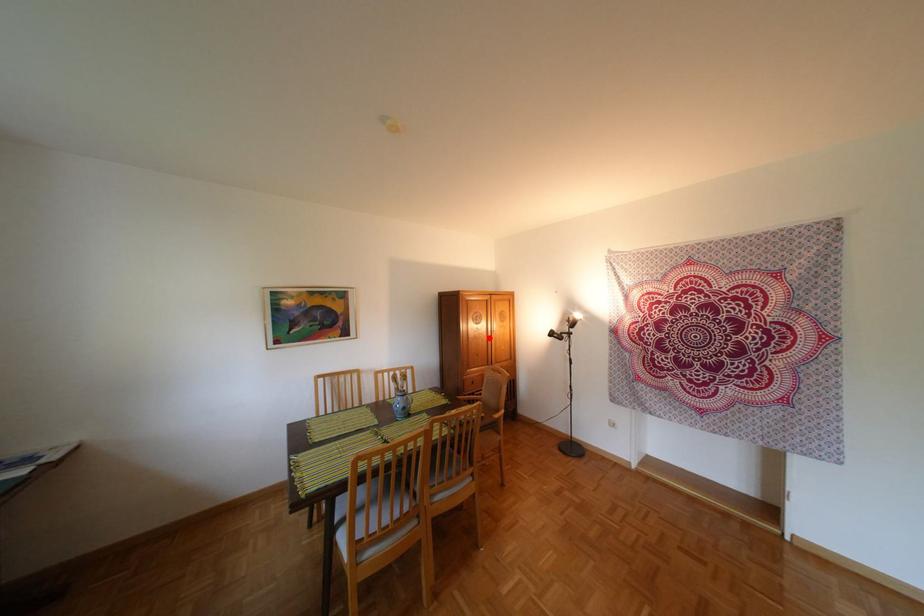
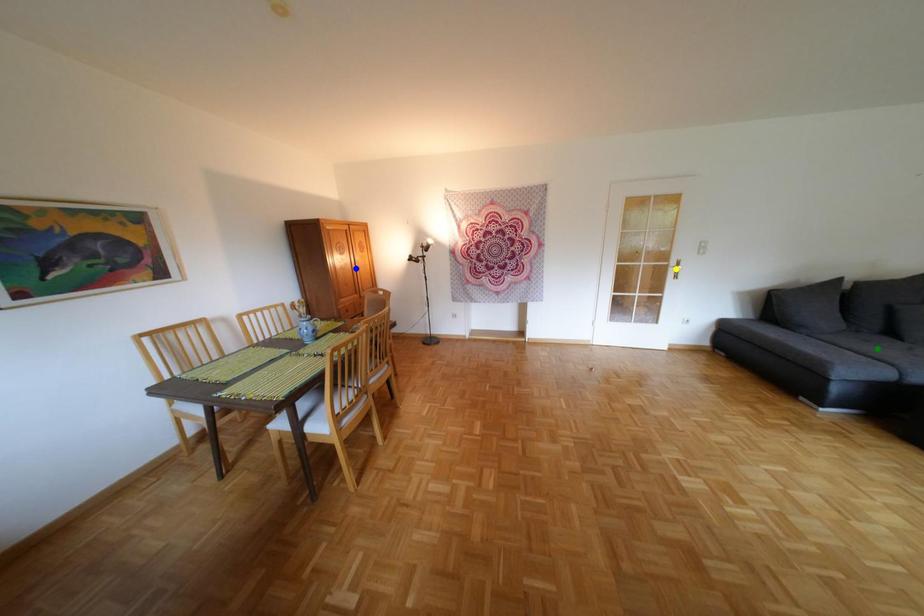
Question: I am providing you with two images of the same scene from different viewpoints. A red point is marked on the first image. You are given multiple points on the second image. In image 2, which mark is for the same physical point as the one in image 1?

Choices:
 (A) green point
 (B) yellow point
 (C) blue point

Answer: (C)